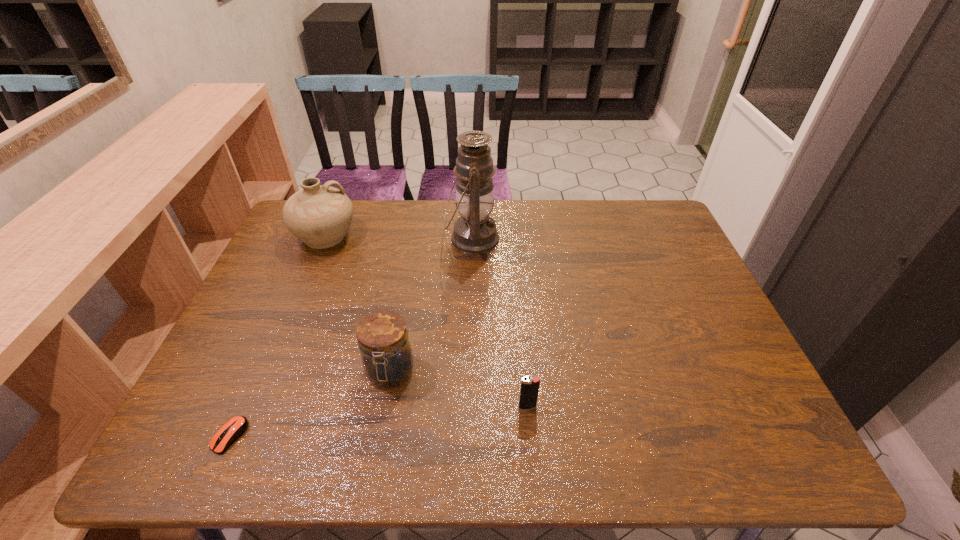
Image resolution: width=960 pixels, height=540 pixels. I want to click on vacant space that is in between the nearest object and the oil lamp, so tap(351, 338).

Locate an element on the screen. blank region between the fourth object from left to right and the fourth shortest object is located at coordinates (399, 238).

The width and height of the screenshot is (960, 540). What are the coordinates of `empty space between the oil lamp and the third object from right to left` in the screenshot? It's located at (431, 306).

Find the location of `vacant area between the rightmost object and the nearest object`. vacant area between the rightmost object and the nearest object is located at coordinates (378, 421).

You are a GUI agent. You are given a task and a screenshot of the screen. Output one action in this format:
    pyautogui.click(x=<x>, y=<y>)
    Task: Click on the free space between the jar and the pottery
    The height and width of the screenshot is (540, 960).
    Given the screenshot: What is the action you would take?
    pyautogui.click(x=358, y=304)

Locate which object is the third closest to the computer mouse. Please provide its 2D coordinates. Your answer should be formatted as a tuple, i.e. [(x, y)], where the tuple contains the x and y coordinates of a point satisfying the conditions above.

[(529, 391)]

Identify which object is located as the second nearest to the jar. Please provide its 2D coordinates. Your answer should be formatted as a tuple, i.e. [(x, y)], where the tuple contains the x and y coordinates of a point satisfying the conditions above.

[(529, 391)]

The width and height of the screenshot is (960, 540). In order to click on vacant area in the image that satisfies the following two spatial constraints: 1. on the back side of the fourth shortest object; 2. on the left side of the computer mouse in this screenshot , I will do `click(317, 236)`.

Locate an element on the screen. The height and width of the screenshot is (540, 960). vacant point that satisfies the following two spatial constraints: 1. on the back side of the rightmost object; 2. on the left side of the shortest object is located at coordinates (243, 407).

Identify the location of vacant region that satisfies the following two spatial constraints: 1. on the back side of the nearest object; 2. on the left side of the oil lamp. This screenshot has width=960, height=540. (316, 239).